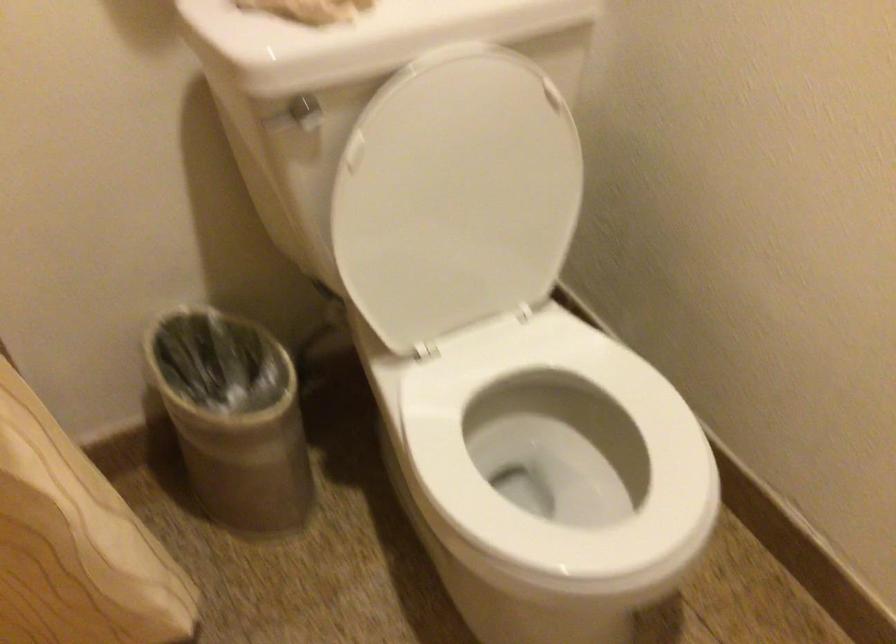
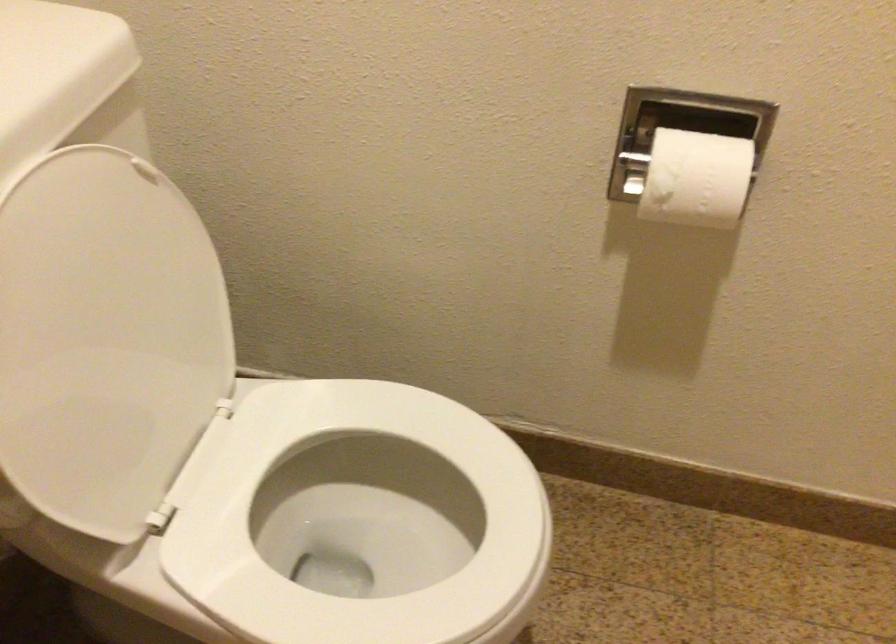
The point at (449, 202) is marked in the first image. Where is the corresponding point in the second image?

(105, 339)